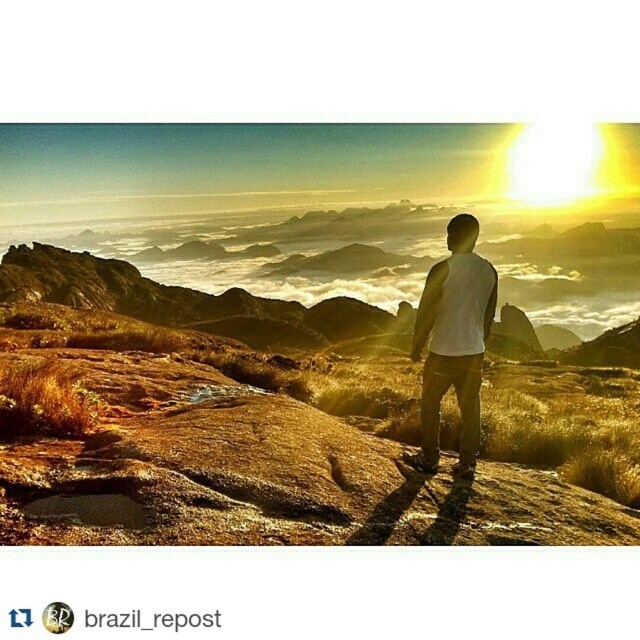
Question: Is brown rocky mountain at center behind white matte shirt at center?

Choices:
 (A) no
 (B) yes

Answer: (A)

Question: Is brown rocky mountain at center thinner than white matte shirt at center?

Choices:
 (A) yes
 (B) no

Answer: (B)

Question: Is brown rocky mountain at center to the left of white matte shirt at center from the viewer's perspective?

Choices:
 (A) yes
 (B) no

Answer: (A)

Question: Which point appears closest to the camera in this image?

Choices:
 (A) (468, 253)
 (B) (8, 529)

Answer: (B)

Question: Which object is farther from the camera taking this photo?

Choices:
 (A) brown rocky mountain at center
 (B) white matte shirt at center

Answer: (B)